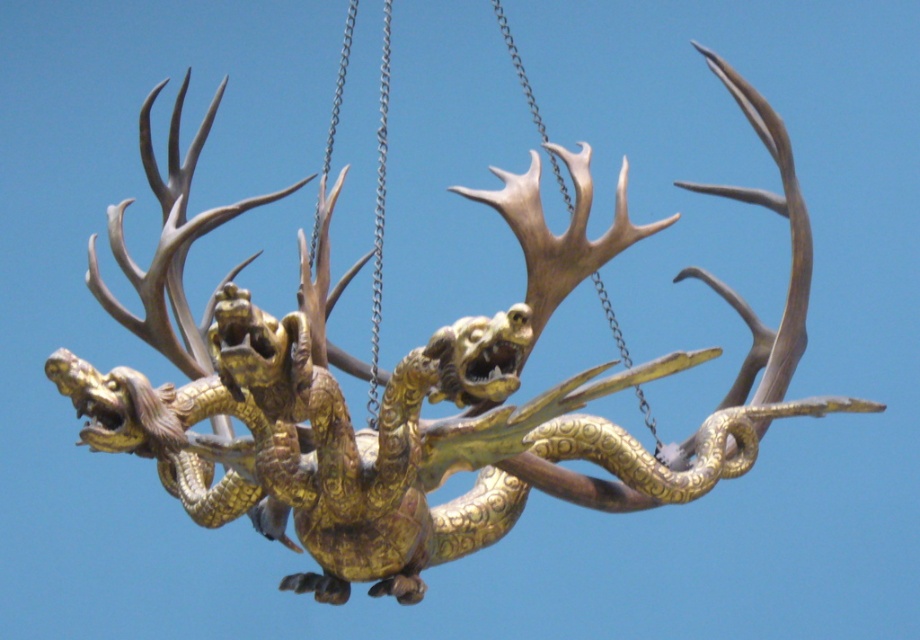
You are an architect designing a new chandelier. You need to place a decorative element at the point marked by the coordinates point (378, 218). What object will be at that location?

The point (378, 218) indicates the location of the silver metallic chain at center, so placing a decorative element there would place it at the silver metallic chain at center.